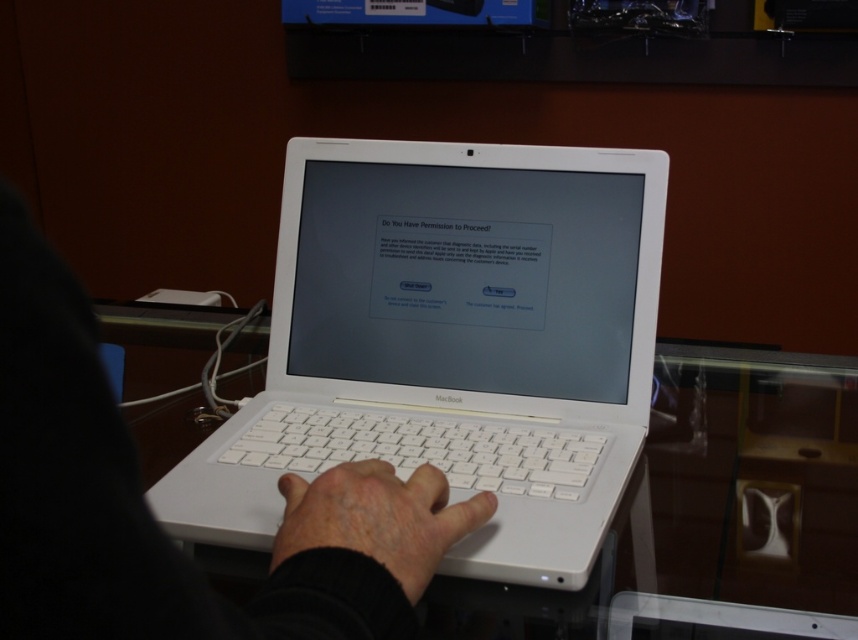
Can you confirm if white matte laptop at center is bigger than white plastic keyboard at center?

Yes.

Is white matte laptop at center taller than white plastic keyboard at center?

Indeed, white matte laptop at center has a greater height compared to white plastic keyboard at center.

What do you see at coordinates (149, 509) in the screenshot? I see `white matte laptop at center` at bounding box center [149, 509].

Identify the location of white matte laptop at center. The image size is (858, 640). (149, 509).

Is white plastic keyboard at center shorter than white matte hand at center?

Correct, white plastic keyboard at center is not as tall as white matte hand at center.

From the picture: Between white plastic keyboard at center and white matte hand at center, which one has less height?

white plastic keyboard at center

Who is more distant from viewer, (503, 456) or (385, 492)?

Point (503, 456)

The image size is (858, 640). What are the coordinates of `white plastic keyboard at center` in the screenshot? It's located at (421, 448).

Which is behind, point (331, 252) or point (139, 499)?

The point (331, 252) is behind.

You are a GUI agent. You are given a task and a screenshot of the screen. Output one action in this format:
    pyautogui.click(x=<x>, y=<y>)
    Task: Click on the white plastic laptop at center
    
    Given the screenshot: What is the action you would take?
    pyautogui.click(x=451, y=342)

This screenshot has width=858, height=640. What are the coordinates of `white plastic laptop at center` in the screenshot? It's located at (451, 342).